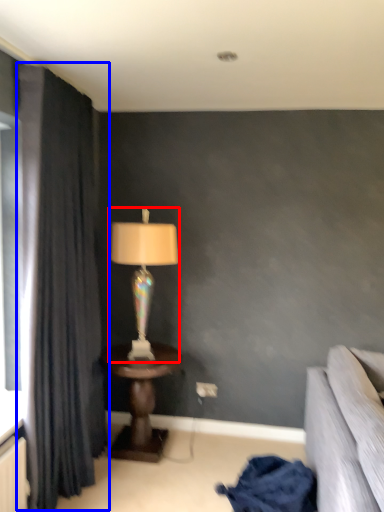
Question: Among these objects, which one is nearest to the camera, lamp (highlighted by a red box) or curtain (highlighted by a blue box)?

Choices:
 (A) lamp
 (B) curtain

Answer: (B)